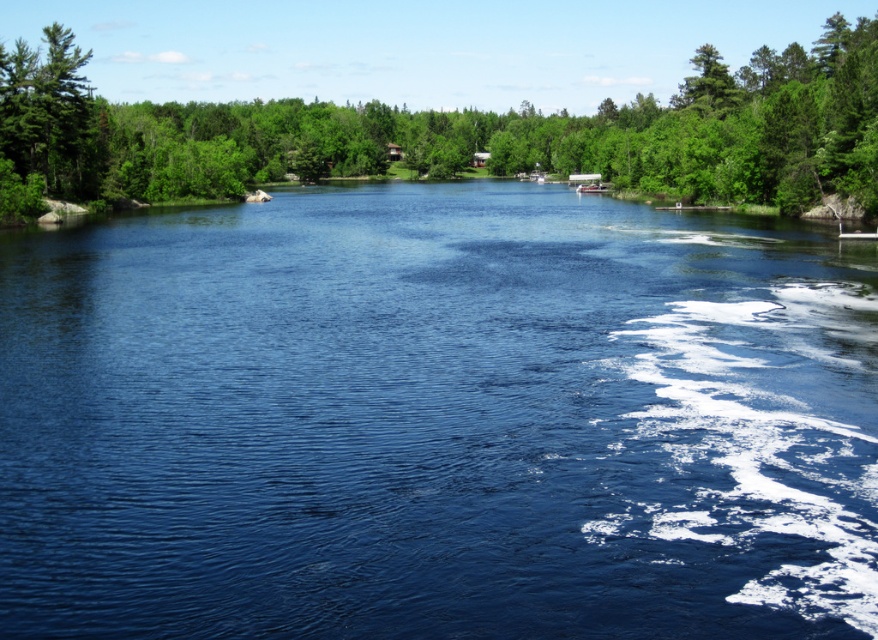
Does blue water at center appear under green leafy tree at upper center?

Yes.

Does point (90, 296) come in front of point (265, 51)?

Yes, point (90, 296) is closer to viewer.

Identify the location of blue water at center. This screenshot has width=878, height=640. (437, 420).

Does point (861, 356) come in front of point (25, 72)?

Yes.

Find the location of `blue water at center`. blue water at center is located at coordinates (437, 420).

Who is shorter, green leafy tree at upper center or green matte tree at upper left?

With less height is green matte tree at upper left.

How much distance is there between green leafy tree at upper center and green matte tree at upper left?

The distance of green leafy tree at upper center from green matte tree at upper left is 178.16 meters.

Is point (353, 161) behind point (11, 61)?

That is True.

Locate an element on the screen. The width and height of the screenshot is (878, 640). green leafy tree at upper center is located at coordinates (462, 131).